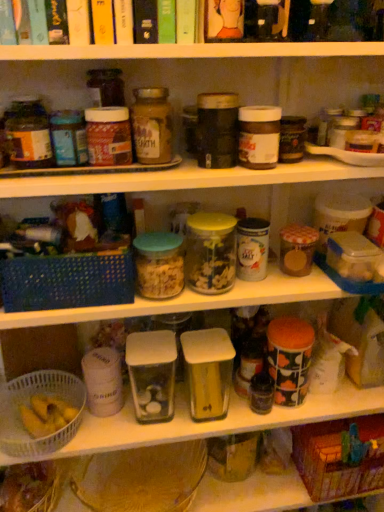
Question: Is brown woven basket at lower right, the third basket from the top, not inside translucent plastic bag at lower left?

Choices:
 (A) no
 (B) yes

Answer: (B)

Question: Considering the relative sizes of brown woven basket at lower right, the third basket from the top, and translucent plastic bag at lower left in the image provided, is brown woven basket at lower right, the third basket from the top, bigger than translucent plastic bag at lower left?

Choices:
 (A) yes
 (B) no

Answer: (A)

Question: From the image's perspective, is brown woven basket at lower right, which is the 3th basket from left to right, on translucent plastic bag at lower left?

Choices:
 (A) yes
 (B) no

Answer: (A)

Question: Is brown woven basket at lower right, the 1th basket when ordered from right to left, next to translucent plastic bag at lower left?

Choices:
 (A) yes
 (B) no

Answer: (B)

Question: Could you tell me if brown woven basket at lower right, the 1th basket when ordered from right to left, is facing translucent plastic bag at lower left?

Choices:
 (A) yes
 (B) no

Answer: (B)

Question: Can you confirm if brown woven basket at lower right, the first basket in the bottom-to-top sequence, is smaller than translucent plastic bag at lower left?

Choices:
 (A) no
 (B) yes

Answer: (A)

Question: Is translucent plastic bag at lower left smaller than white plastic basket at lower left, acting as the 2th basket starting from the bottom?

Choices:
 (A) yes
 (B) no

Answer: (A)

Question: From the image's perspective, is translucent plastic bag at lower left above white plastic basket at lower left, which is the first basket from left to right?

Choices:
 (A) yes
 (B) no

Answer: (B)

Question: From a real-world perspective, does translucent plastic bag at lower left sit lower than white plastic basket at lower left, the 2th basket from the top?

Choices:
 (A) yes
 (B) no

Answer: (A)

Question: Are translucent plastic bag at lower left and white plastic basket at lower left, the 2th basket from the top, beside each other?

Choices:
 (A) no
 (B) yes

Answer: (A)

Question: Considering the relative sizes of translucent plastic bag at lower left and white plastic basket at lower left, acting as the 2th basket starting from the bottom, in the image provided, is translucent plastic bag at lower left thinner than white plastic basket at lower left, acting as the 2th basket starting from the bottom,?

Choices:
 (A) no
 (B) yes

Answer: (B)

Question: From the image's perspective, is translucent plastic bag at lower left located beneath white plastic basket at lower left, the 3th basket in the right-to-left sequence?

Choices:
 (A) yes
 (B) no

Answer: (A)

Question: From the image's perspective, is matte glass jar at center, marked as the first bottle in a right-to-left arrangement, located beneath translucent plastic bag at lower left?

Choices:
 (A) yes
 (B) no

Answer: (B)